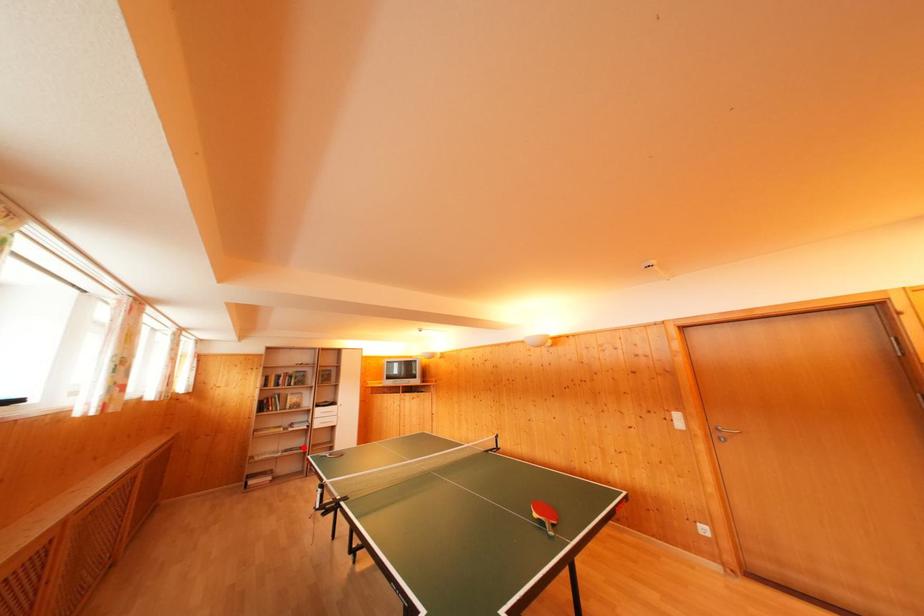
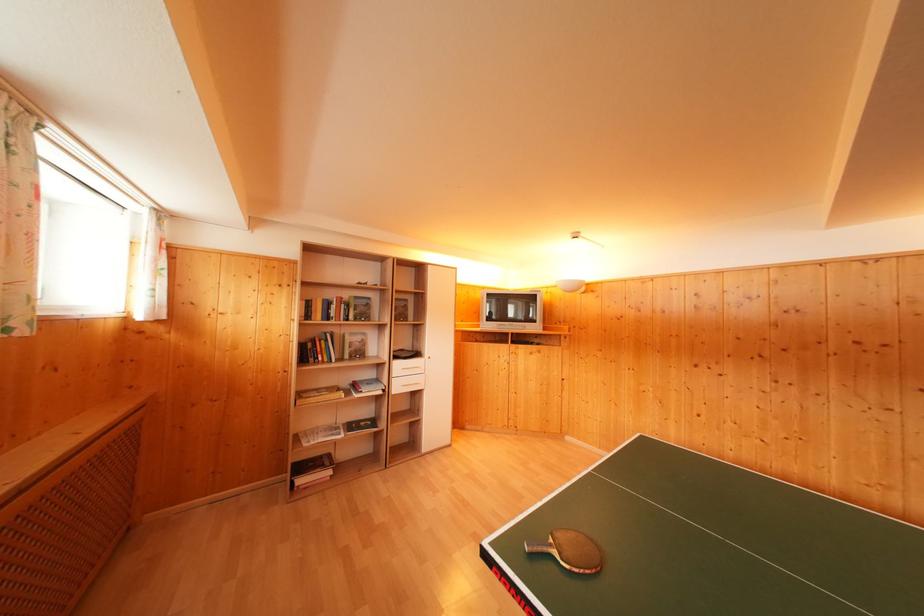
Question: I am providing you with two images of the same scene from different viewpoints. A red point is shown in image1. For the corresponding object point in image2, is it positioned nearer or farther from the camera?

Choices:
 (A) Nearer
 (B) Farther

Answer: (B)